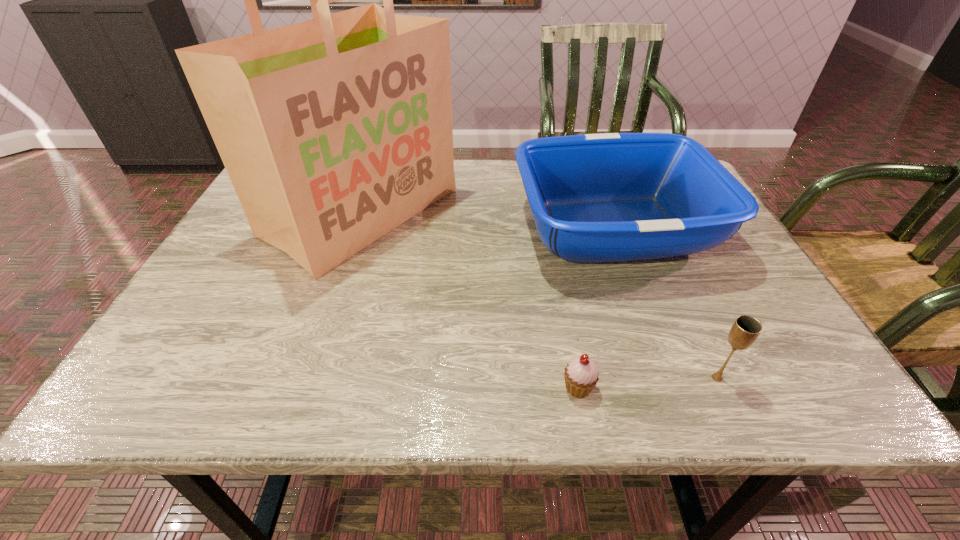
Where is `empty space between the leftmost object and the chalice`? The image size is (960, 540). empty space between the leftmost object and the chalice is located at coordinates (540, 295).

You are a GUI agent. You are given a task and a screenshot of the screen. Output one action in this format:
    pyautogui.click(x=<x>, y=<y>)
    Task: Click on the second closest object relative to the chalice
    
    Given the screenshot: What is the action you would take?
    pyautogui.click(x=614, y=197)

This screenshot has height=540, width=960. Identify the location of object that is the closest to the cupcake. (744, 332).

What are the coordinates of `vacant region that satisfies the following two spatial constraints: 1. on the back side of the tray; 2. on the left side of the cupcake` in the screenshot? It's located at coord(548,229).

Identify the location of free spot that satisfies the following two spatial constraints: 1. on the back side of the chalice; 2. on the right side of the cupcake. This screenshot has width=960, height=540. (576, 378).

Locate an element on the screen. The width and height of the screenshot is (960, 540). vacant area in the image that satisfies the following two spatial constraints: 1. on the front side of the leftmost object; 2. on the right side of the chalice is located at coordinates (306, 378).

Where is `vacant space that satisfies the following two spatial constraints: 1. on the back side of the tray; 2. on the right side of the shortest object`? This screenshot has height=540, width=960. vacant space that satisfies the following two spatial constraints: 1. on the back side of the tray; 2. on the right side of the shortest object is located at coordinates (548, 229).

Where is `free space that satisfies the following two spatial constraints: 1. on the back side of the tray; 2. on the left side of the shortest object`? The height and width of the screenshot is (540, 960). free space that satisfies the following two spatial constraints: 1. on the back side of the tray; 2. on the left side of the shortest object is located at coordinates click(548, 229).

The height and width of the screenshot is (540, 960). Identify the location of vacant area in the image that satisfies the following two spatial constraints: 1. on the back side of the chalice; 2. on the right side of the shortest object. (576, 378).

Where is `blank space that satisfies the following two spatial constraints: 1. on the back side of the chalice; 2. on the left side of the shortest object`? The image size is (960, 540). blank space that satisfies the following two spatial constraints: 1. on the back side of the chalice; 2. on the left side of the shortest object is located at coordinates (576, 378).